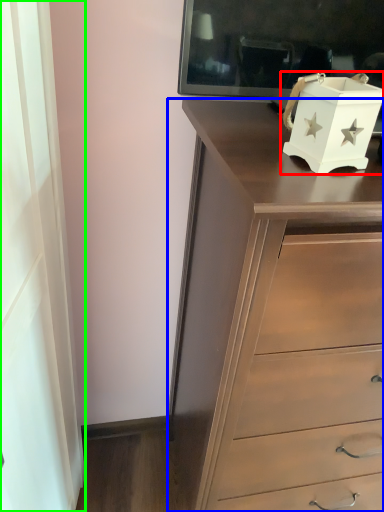
Question: Which object is positioned closest to box (highlighted by a red box)? Select from chest of drawers (highlighted by a blue box) and curtain (highlighted by a green box).

Choices:
 (A) chest of drawers
 (B) curtain

Answer: (A)